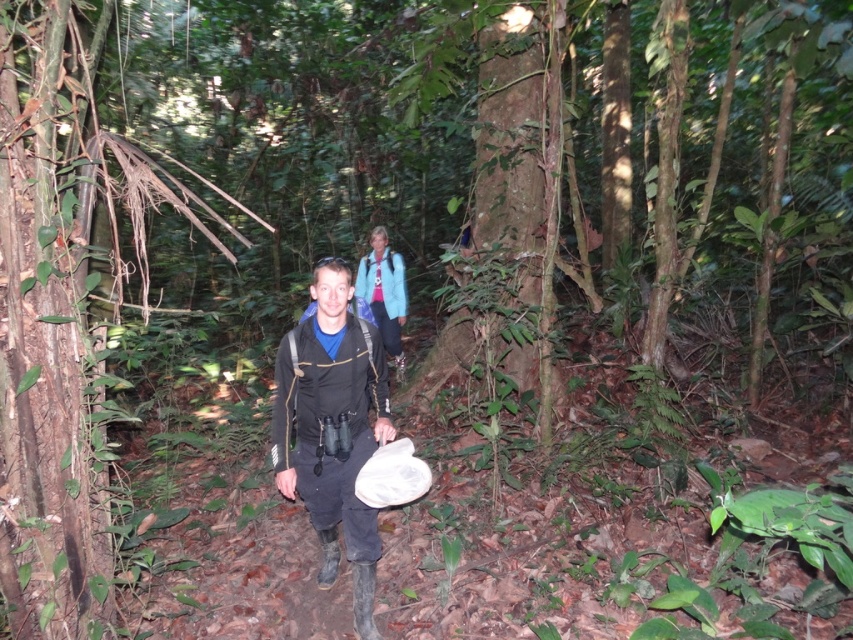
Question: Among these points, which one is nearest to the camera?

Choices:
 (A) (277, 412)
 (B) (399, 312)

Answer: (A)

Question: Is the position of matte black jacket at center more distant than that of blue fabric jacket at upper center?

Choices:
 (A) yes
 (B) no

Answer: (B)

Question: Which point is farther from the camera taking this photo?

Choices:
 (A) (367, 257)
 (B) (375, 636)

Answer: (A)

Question: Does matte black jacket at center lie in front of blue fabric jacket at upper center?

Choices:
 (A) no
 (B) yes

Answer: (B)

Question: Is matte black jacket at center above blue fabric jacket at upper center?

Choices:
 (A) no
 (B) yes

Answer: (A)